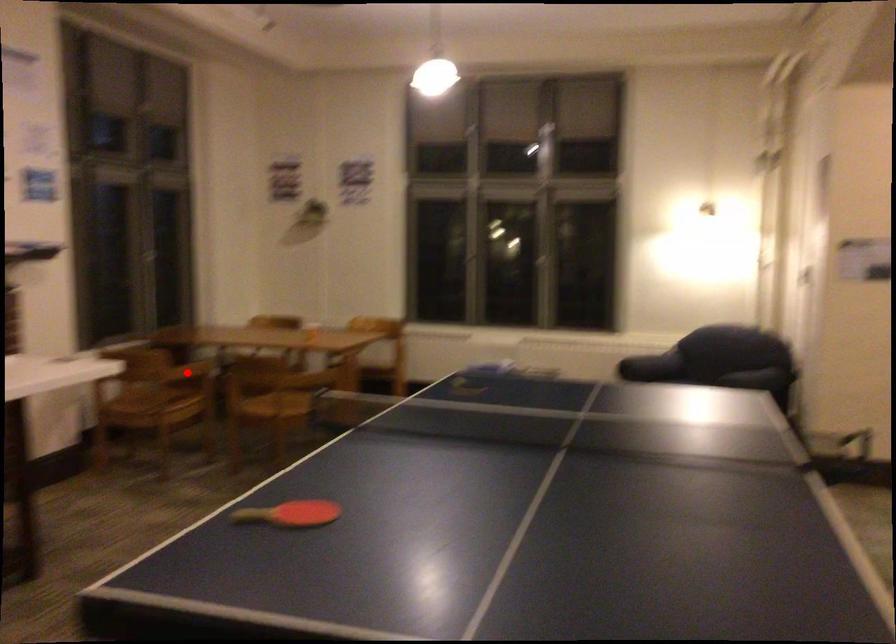
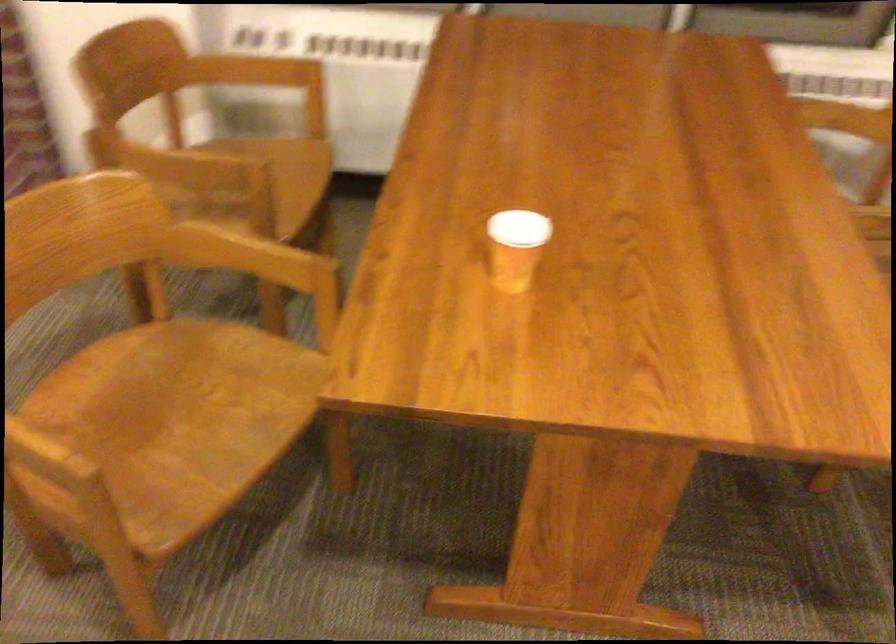
Find the pixel in the second image that matches the highlighted location in the first image.

(169, 163)